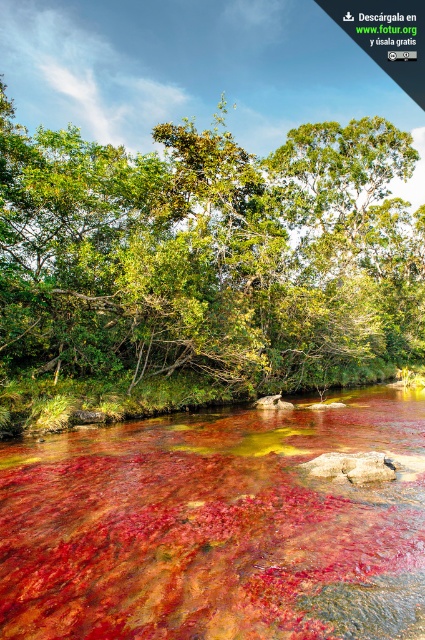
You are standing at the edge of the river and want to reach the green leafy tree at center. Do you need to walk through the translucent red water at center?

The green leafy tree at center is closer to you than the translucent red water at center, so you can reach the green leafy tree at center without walking through the translucent red water at center.

You are standing at point [209,256] in the image. What is the nearest object to you?

The nearest object to you at point [209,256] is the green leafy tree at center.